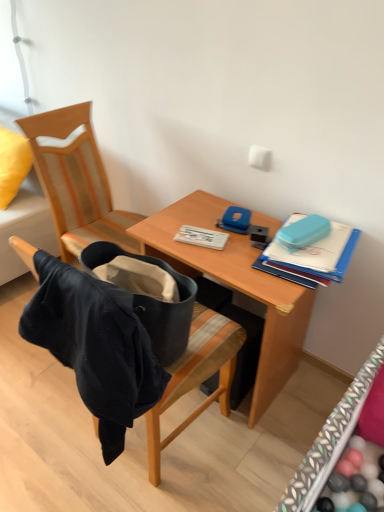
The image size is (384, 512). I want to click on free space that is in between velvet black bag at center, the first chair viewed from the front, and wooden desk at center, so [x=210, y=457].